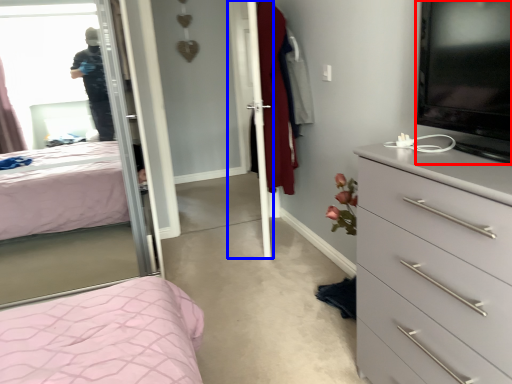
Question: Which object appears farthest to the camera in this image, television (highlighted by a red box) or screen door (highlighted by a blue box)?

Choices:
 (A) television
 (B) screen door

Answer: (B)